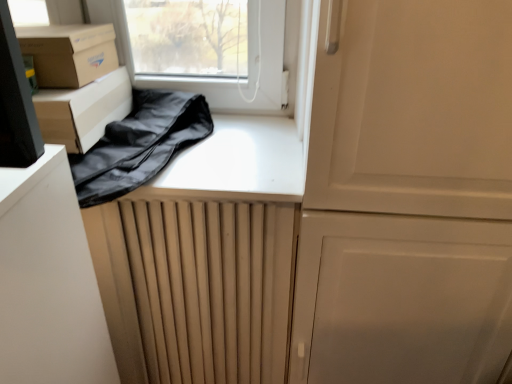
Question: Can you confirm if brown cardboard box at upper left, the 2th cardboard box from the bottom, is smaller than black fabric bag at upper left?

Choices:
 (A) no
 (B) yes

Answer: (B)

Question: From the image's perspective, is brown cardboard box at upper left, the 2th cardboard box from the bottom, below black fabric bag at upper left?

Choices:
 (A) no
 (B) yes

Answer: (A)

Question: Is the surface of brown cardboard box at upper left, the 2th cardboard box from the bottom, in direct contact with black fabric bag at upper left?

Choices:
 (A) no
 (B) yes

Answer: (A)

Question: Does brown cardboard box at upper left, the first cardboard box in the top-to-bottom sequence, come behind black fabric bag at upper left?

Choices:
 (A) no
 (B) yes

Answer: (B)

Question: Is brown cardboard box at upper left, the first cardboard box in the top-to-bottom sequence, surrounding black fabric bag at upper left?

Choices:
 (A) yes
 (B) no

Answer: (B)

Question: Considering the relative sizes of brown cardboard box at upper left, the first cardboard box in the top-to-bottom sequence, and black fabric bag at upper left in the image provided, is brown cardboard box at upper left, the first cardboard box in the top-to-bottom sequence, wider than black fabric bag at upper left?

Choices:
 (A) yes
 (B) no

Answer: (B)

Question: Can you confirm if matte cardboard box at left, which is counted as the 1th cardboard box, starting from the bottom, is smaller than black fabric bag at upper left?

Choices:
 (A) yes
 (B) no

Answer: (A)

Question: Is matte cardboard box at left, which is counted as the 1th cardboard box, starting from the bottom, oriented away from black fabric bag at upper left?

Choices:
 (A) yes
 (B) no

Answer: (A)

Question: Is matte cardboard box at left, the 2th cardboard box when ordered from top to bottom, thinner than black fabric bag at upper left?

Choices:
 (A) yes
 (B) no

Answer: (A)

Question: Is black fabric bag at upper left inside matte cardboard box at left, the 2th cardboard box when ordered from top to bottom?

Choices:
 (A) yes
 (B) no

Answer: (B)

Question: Is matte cardboard box at left, which is counted as the 1th cardboard box, starting from the bottom, far from black fabric bag at upper left?

Choices:
 (A) yes
 (B) no

Answer: (B)

Question: Is matte cardboard box at left, which is counted as the 1th cardboard box, starting from the bottom, to the left of black fabric bag at upper left from the viewer's perspective?

Choices:
 (A) no
 (B) yes

Answer: (B)

Question: Could you tell me if brown cardboard box at upper left, the 2th cardboard box from the bottom, is turned towards matte cardboard box at left, which is counted as the 1th cardboard box, starting from the bottom?

Choices:
 (A) no
 (B) yes

Answer: (A)